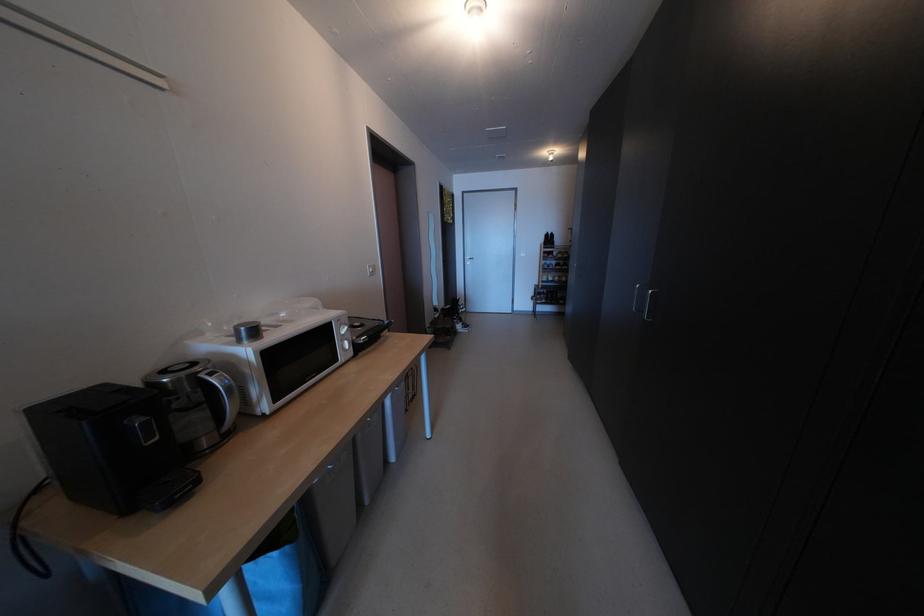
Locate an element on the screen. This screenshot has width=924, height=616. black kettle handle is located at coordinates (224, 395).